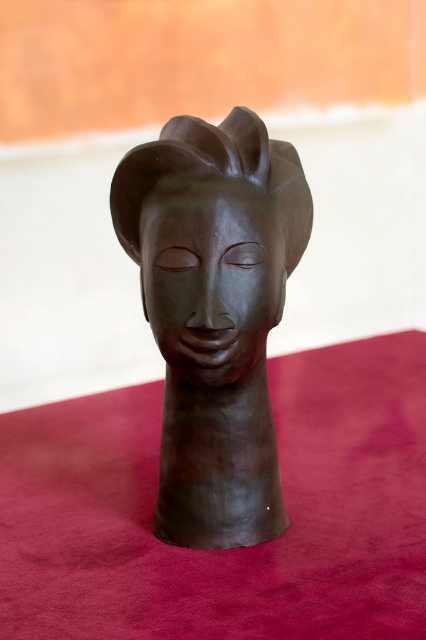
Question: Which point appears closest to the camera in this image?

Choices:
 (A) (279, 314)
 (B) (250, 132)

Answer: (B)

Question: Is matte bronze head at center above matte black face at center?

Choices:
 (A) no
 (B) yes

Answer: (A)

Question: Is matte bronze head at center thinner than matte black face at center?

Choices:
 (A) yes
 (B) no

Answer: (B)

Question: Does matte bronze head at center have a larger size compared to matte black face at center?

Choices:
 (A) no
 (B) yes

Answer: (B)

Question: Among these objects, which one is farthest from the camera?

Choices:
 (A) matte bronze head at center
 (B) matte black face at center

Answer: (A)

Question: Which object is farther from the camera taking this photo?

Choices:
 (A) matte bronze head at center
 (B) matte black face at center

Answer: (A)